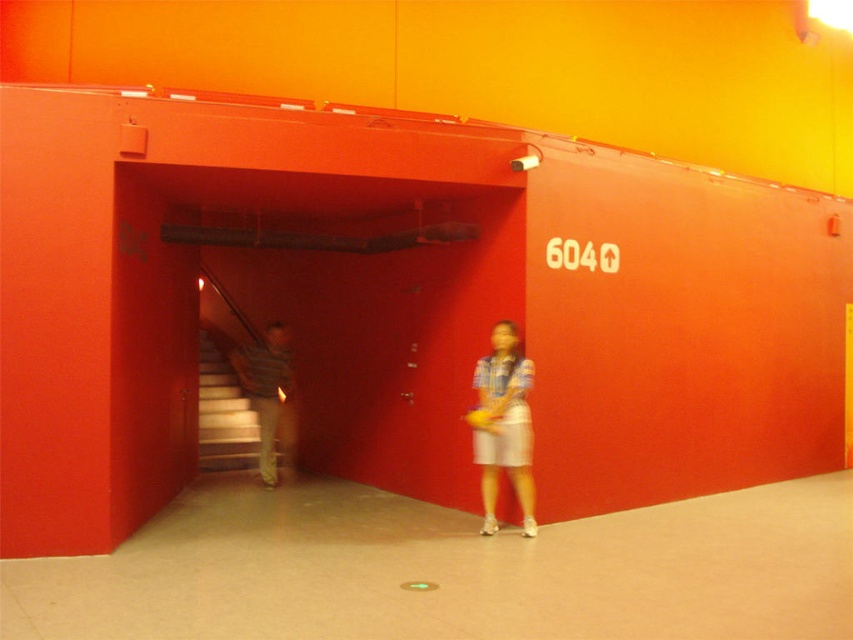
Between blue plaid shirt at center and wooden staircase at left, which one is positioned higher?

blue plaid shirt at center

Does blue plaid shirt at center have a greater width compared to wooden staircase at left?

Incorrect, blue plaid shirt at center's width does not surpass wooden staircase at left's.

Locate an element on the screen. blue plaid shirt at center is located at coordinates (503, 424).

Between striped fabric shirt at left and wooden staircase at left, which one is positioned higher?

Positioned higher is striped fabric shirt at left.

Who is taller, striped fabric shirt at left or wooden staircase at left?

With more height is striped fabric shirt at left.

Does point (276, 420) come farther from viewer compared to point (244, 465)?

No, (276, 420) is closer to viewer.

This screenshot has height=640, width=853. What are the coordinates of `striped fabric shirt at left` in the screenshot? It's located at (268, 397).

Between blue plaid shirt at center and striped fabric shirt at left, which one is positioned lower?

blue plaid shirt at center is below.

Locate an element on the screen. blue plaid shirt at center is located at coordinates (503, 424).